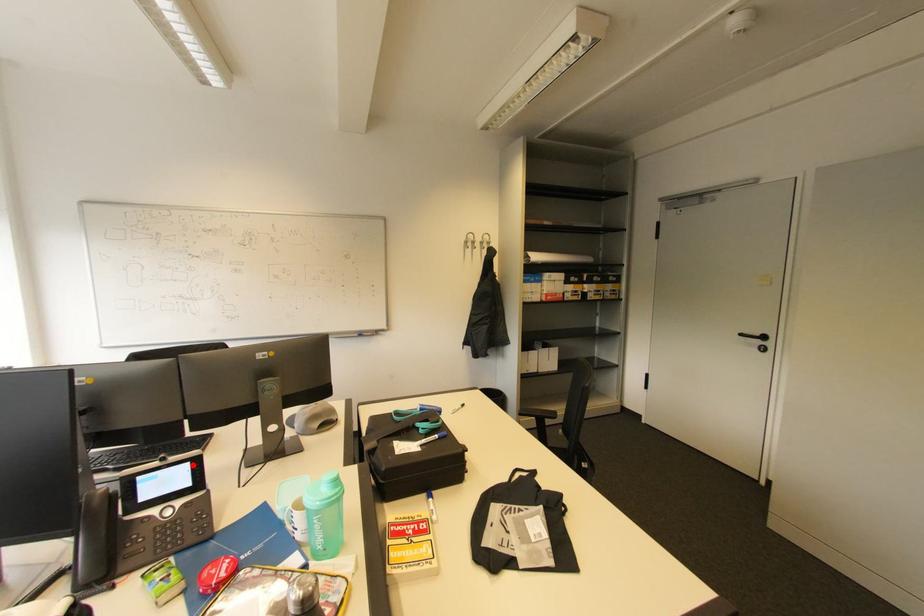
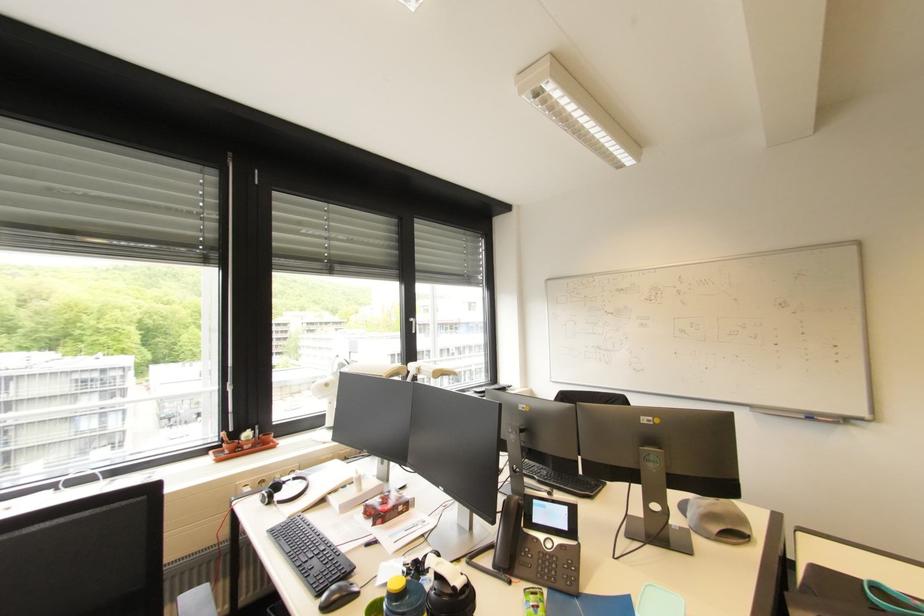
Question: A red point is marked in image1. In image2, is the corresponding 3D point closer to the camera or farther? Reply with the corresponding letter.

Choices:
 (A) The corresponding 3D point is closer.
 (B) The corresponding 3D point is farther.

Answer: (A)